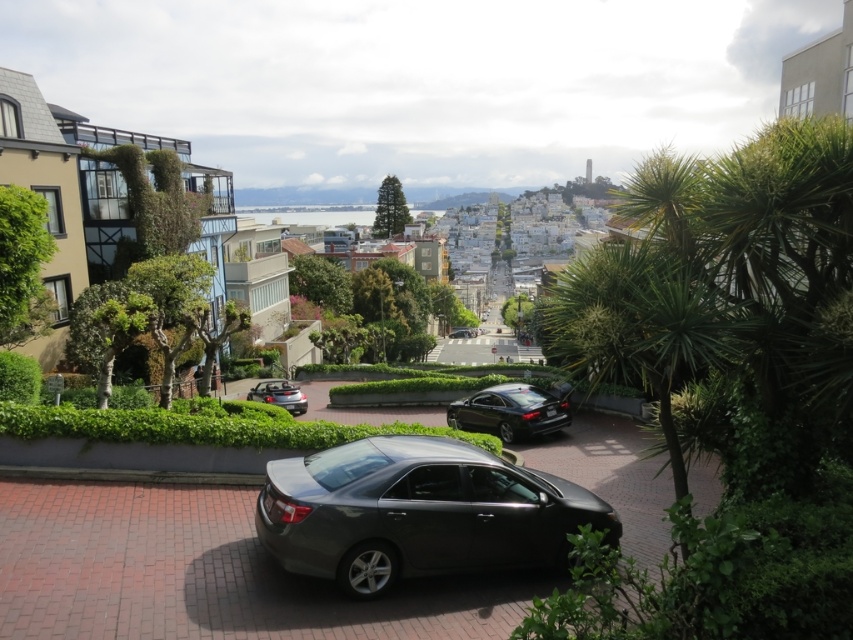
Is satin black sedan at center taller than glossy black sedan at center?

In fact, satin black sedan at center may be shorter than glossy black sedan at center.

Does satin black sedan at center have a lesser width compared to glossy black sedan at center?

Correct, satin black sedan at center's width is less than glossy black sedan at center's.

Who is more distant from viewer, (529, 518) or (550, 396)?

The point (550, 396) is behind.

This screenshot has height=640, width=853. Identify the location of satin black sedan at center. (416, 513).

Is glossy black sedan at center thinner than satin silver convertible at center?

No.

Is point (465, 413) closer to viewer compared to point (285, 397)?

Yes, it is in front of point (285, 397).

Who is more distant from viewer, (457, 424) or (260, 385)?

The point (260, 385) is behind.

Locate an element on the screen. Image resolution: width=853 pixels, height=640 pixels. glossy black sedan at center is located at coordinates (509, 412).

Does satin silver convertible at center appear over shiny black sedan at center?

Incorrect, satin silver convertible at center is not positioned above shiny black sedan at center.

Does satin silver convertible at center lie behind shiny black sedan at center?

No, satin silver convertible at center is in front of shiny black sedan at center.

Is point (274, 394) more distant than point (463, 336)?

No, it is in front of (463, 336).

At what (x,y) coordinates should I click in order to perform the action: click on satin silver convertible at center. Please return your answer as a coordinate pair (x, y). This screenshot has width=853, height=640. Looking at the image, I should click on (279, 394).